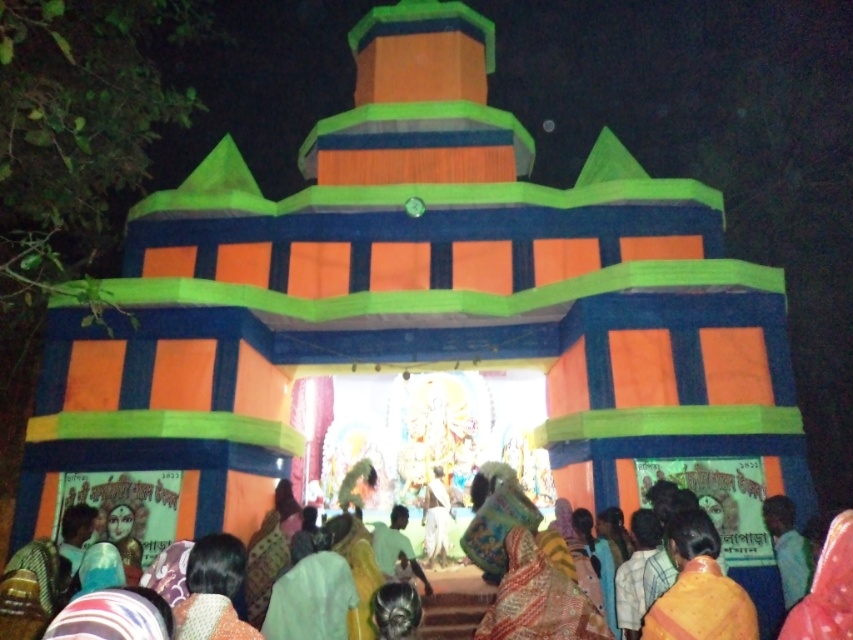
You are standing in front of the temple structure and want to take a photo of the multicolored fabric at center and the multicolored fabric robe at lower center. Which object should you focus on first to ensure both are in frame without moving the camera?

You should focus on the multicolored fabric at center first because it is closer to the viewer than the multicolored fabric robe at lower center. By focusing on the closer object, the robe in the background will still be in focus due to depth of field, ensuring both are in frame without moving the camera.

You are an attendee at this event and want to take a photo of the multicolored fabric at center and the multicolored fabric robe at lower center. Which one should you focus on first to ensure it is in the foreground?

The multicolored fabric at center is positioned over the multicolored fabric robe at lower center, so you should focus on the multicolored fabric robe at lower center first to ensure it is in the foreground.

You are a photographer positioned in front of the temple structure. You want to take a photo that includes both the multicolored fabric at center and the yellow fabric robe at center. Which object should you focus on first to ensure both are in frame?

The multicolored fabric at center is much taller than the yellow fabric robe at center. To ensure both are in frame, focus on the taller multicolored fabric at center first, then adjust the camera angle to include the shorter yellow fabric robe at center.